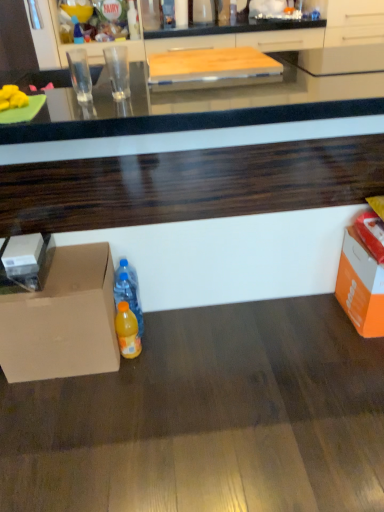
Question: Can you confirm if orange cardboard box at lower right is bigger than white cardboard box at left?

Choices:
 (A) no
 (B) yes

Answer: (B)

Question: Can you confirm if orange cardboard box at lower right is thinner than white cardboard box at left?

Choices:
 (A) yes
 (B) no

Answer: (B)

Question: Is orange cardboard box at lower right facing away from white cardboard box at left?

Choices:
 (A) no
 (B) yes

Answer: (A)

Question: Is orange cardboard box at lower right taller than white cardboard box at left?

Choices:
 (A) no
 (B) yes

Answer: (B)

Question: Does orange cardboard box at lower right come behind white cardboard box at left?

Choices:
 (A) no
 (B) yes

Answer: (B)

Question: From the image's perspective, is orange cardboard box at lower right located above white cardboard box at left?

Choices:
 (A) yes
 (B) no

Answer: (B)

Question: Is translucent plastic bottle at center, which ranks as the second bottle in right-to-left order, further to the viewer compared to matte cardboard box at lower left?

Choices:
 (A) yes
 (B) no

Answer: (A)

Question: Does translucent plastic bottle at center, which appears as the second bottle when viewed from the top, have a smaller size compared to matte cardboard box at lower left?

Choices:
 (A) no
 (B) yes

Answer: (B)

Question: Would you say translucent plastic bottle at center, which ranks as the second bottle in right-to-left order, is outside matte cardboard box at lower left?

Choices:
 (A) yes
 (B) no

Answer: (A)

Question: Can you confirm if translucent plastic bottle at center, the 2th bottle when ordered from back to front, is taller than matte cardboard box at lower left?

Choices:
 (A) yes
 (B) no

Answer: (B)

Question: Is translucent plastic bottle at center, the second bottle in the front-to-back sequence, positioned far away from matte cardboard box at lower left?

Choices:
 (A) yes
 (B) no

Answer: (B)

Question: Can you see translucent plastic bottle at center, which appears as the second bottle when viewed from the top, touching matte cardboard box at lower left?

Choices:
 (A) no
 (B) yes

Answer: (A)

Question: Can you confirm if yellow matte bananas at left is positioned to the right of orange cardboard box at lower right?

Choices:
 (A) no
 (B) yes

Answer: (A)